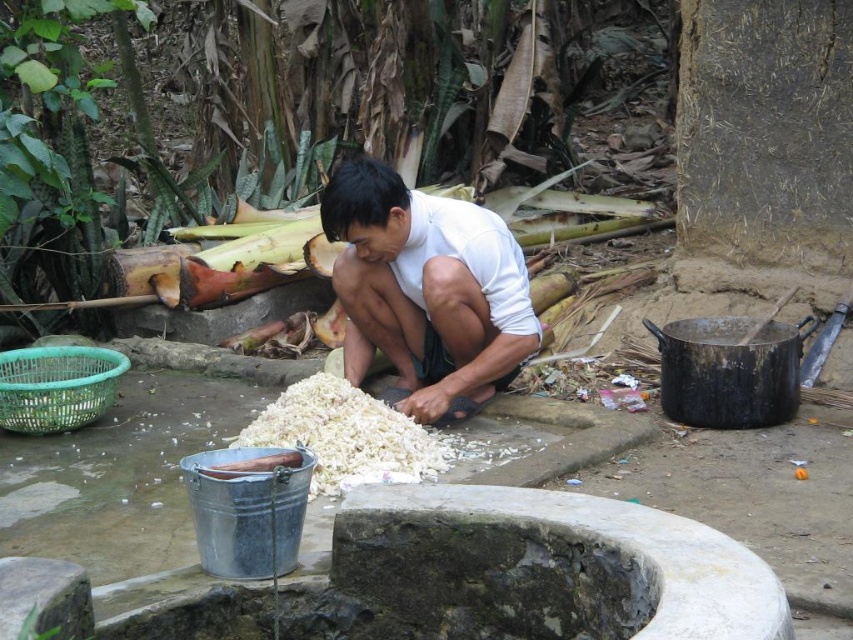
You are a photographer taking a picture of the scene. You notice the white matte shirt at center and the white fluffy food at center. Which object is positioned higher in the image?

The white matte shirt at center is located above the white fluffy food at center, so it is positioned higher in the image.